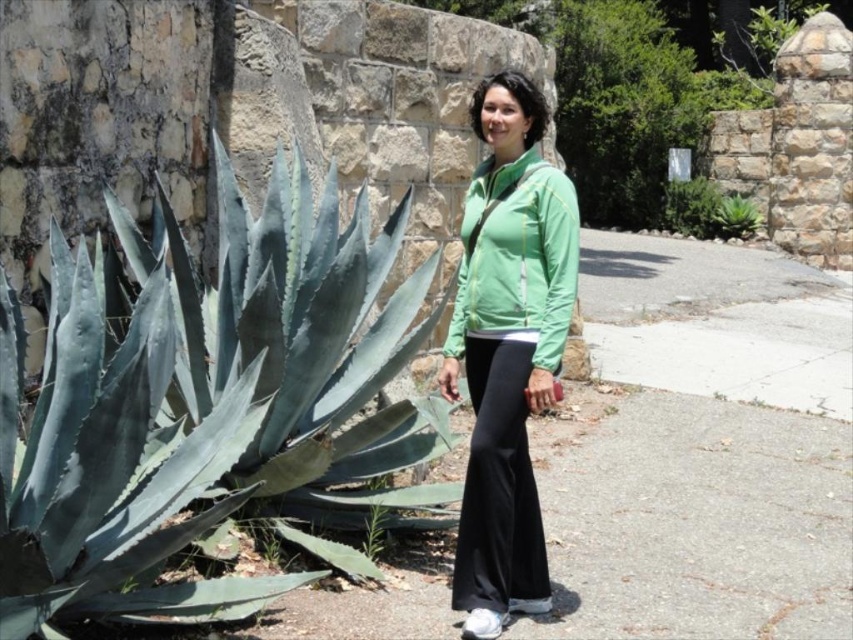
Who is lower down, green fabric jacket at center or green succulent at center?

green fabric jacket at center is lower down.

Is green fabric jacket at center thinner than green succulent at center?

Yes.

Between point (454, 372) and point (738, 211), which one is positioned in front?

Positioned in front is point (454, 372).

What are the coordinates of `green fabric jacket at center` in the screenshot? It's located at (508, 348).

Does green fabric jacket at center have a smaller size compared to black cotton pants at center?

No.

Is point (514, 483) more distant than point (506, 602)?

Yes.

Between point (474, 468) and point (492, 496), which one is positioned behind?

The point (474, 468) is more distant.

Find the location of a particular element. This screenshot has width=853, height=640. green fabric jacket at center is located at coordinates (508, 348).

Which is below, green succulent at left or green leafy plant at center?

Positioned lower is green succulent at left.

Is green succulent at left wider than green leafy plant at center?

Yes.

Which is behind, point (225, 609) or point (718, 228)?

Point (718, 228)

Locate an element on the screen. The height and width of the screenshot is (640, 853). green succulent at left is located at coordinates [202, 401].